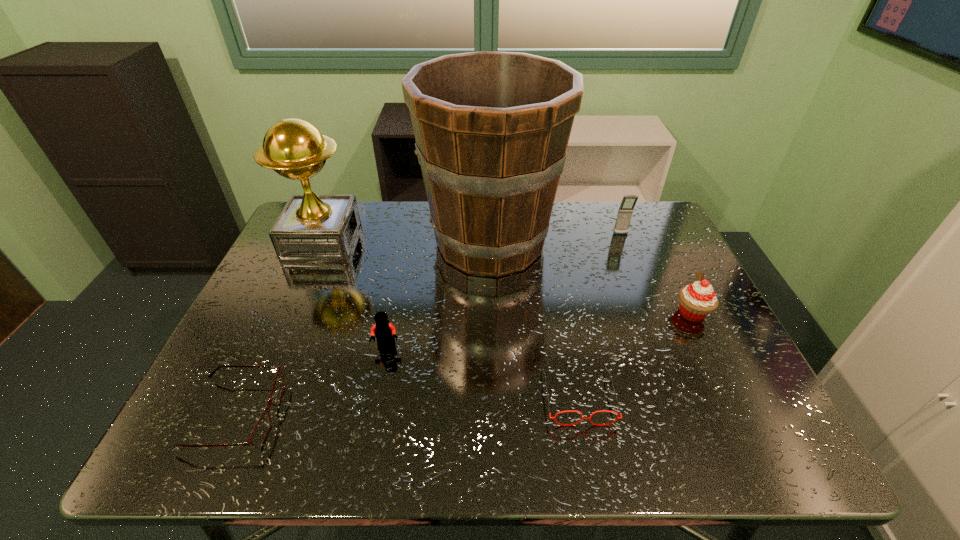
Where is `free spot located on the front of the tallest object`? This screenshot has height=540, width=960. free spot located on the front of the tallest object is located at coordinates (492, 321).

I want to click on free space located 0.270m on the front-facing side of the sixth shortest object, so click(x=449, y=242).

This screenshot has width=960, height=540. Identify the location of vacant space located 0.060m on the front-facing side of the third tallest object. (627, 249).

At what (x,y) coordinates should I click in order to perform the action: click on free space located on the back of the rightmost object. Please return your answer as a coordinate pair (x, y). The height and width of the screenshot is (540, 960). Looking at the image, I should click on (651, 230).

At what (x,y) coordinates should I click in order to perform the action: click on vacant space located on the front-facing side of the third object from left to right. Please return your answer as a coordinate pair (x, y). Looking at the image, I should click on (373, 414).

This screenshot has width=960, height=540. Identify the location of free space located 0.110m on the lenses of the left spectacles. (331, 415).

In order to click on bucket positioned at the far edge in this screenshot , I will do `click(492, 128)`.

Find the location of a particular element. award that is at the far edge is located at coordinates (311, 228).

Locate an element on the screen. cellular telephone located at the far edge is located at coordinates (625, 212).

Find the location of `award at the left edge`. award at the left edge is located at coordinates (311, 228).